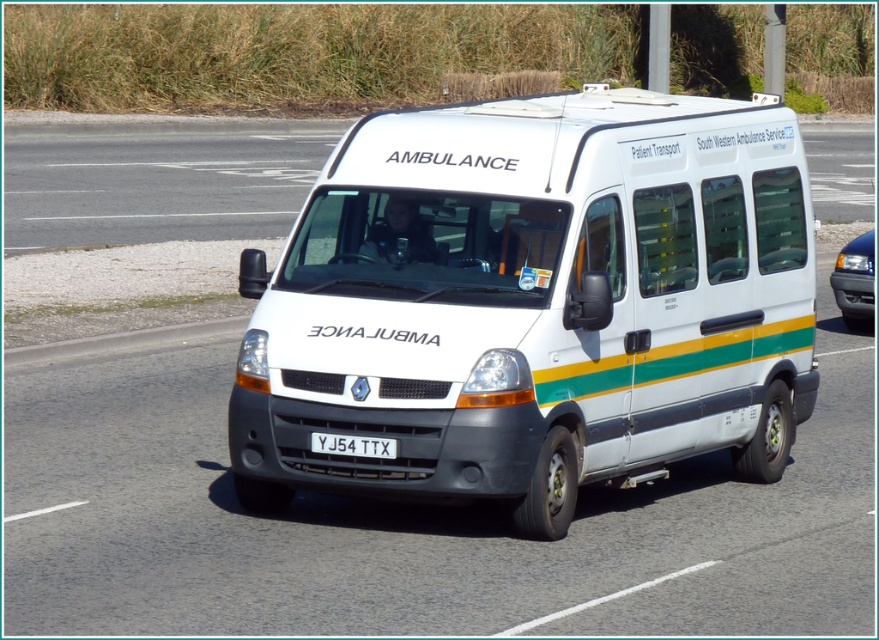
Between point (795, 308) and point (376, 456), which one is positioned in front?

Point (376, 456)

Between white matte ambulance at center and white plastic license plate at center, which one appears on the left side from the viewer's perspective?

Positioned to the left is white plastic license plate at center.

In order to click on white matte ambulance at center in this screenshot , I will do `click(534, 304)`.

The width and height of the screenshot is (879, 640). Find the location of `white matte ambulance at center`. white matte ambulance at center is located at coordinates (534, 304).

From the picture: Measure the distance from white matte ambulance at center to metallic blue car at right.

A distance of 26.47 feet exists between white matte ambulance at center and metallic blue car at right.

Between white matte ambulance at center and metallic blue car at right, which one appears on the right side from the viewer's perspective?

Positioned to the right is metallic blue car at right.

Where is `white matte ambulance at center`? This screenshot has height=640, width=879. white matte ambulance at center is located at coordinates (534, 304).

Where is `white matte ambulance at center`? Image resolution: width=879 pixels, height=640 pixels. white matte ambulance at center is located at coordinates (534, 304).

What do you see at coordinates (855, 280) in the screenshot? I see `metallic blue car at right` at bounding box center [855, 280].

Which is in front, point (851, 241) or point (369, 449)?

Point (369, 449) is more forward.

Which is behind, point (862, 266) or point (361, 448)?

The point (862, 266) is more distant.

Find the location of a particular element. The width and height of the screenshot is (879, 640). metallic blue car at right is located at coordinates (855, 280).